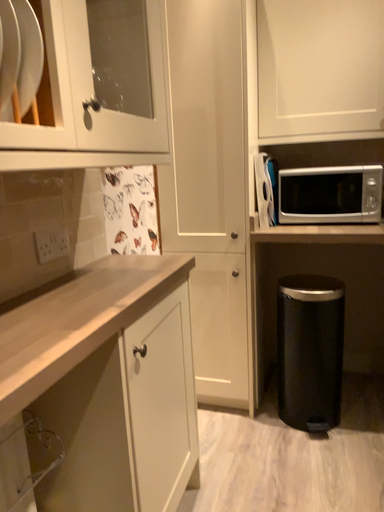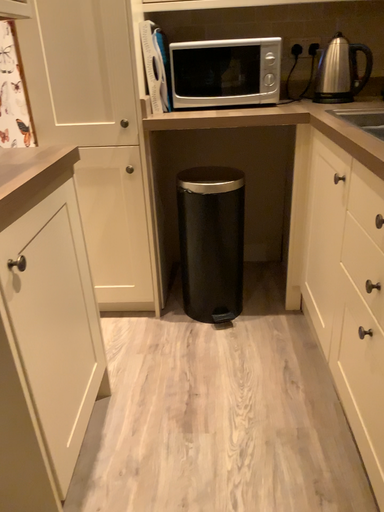
Question: How did the camera likely rotate when shooting the video?

Choices:
 (A) rotated downward
 (B) rotated upward

Answer: (A)